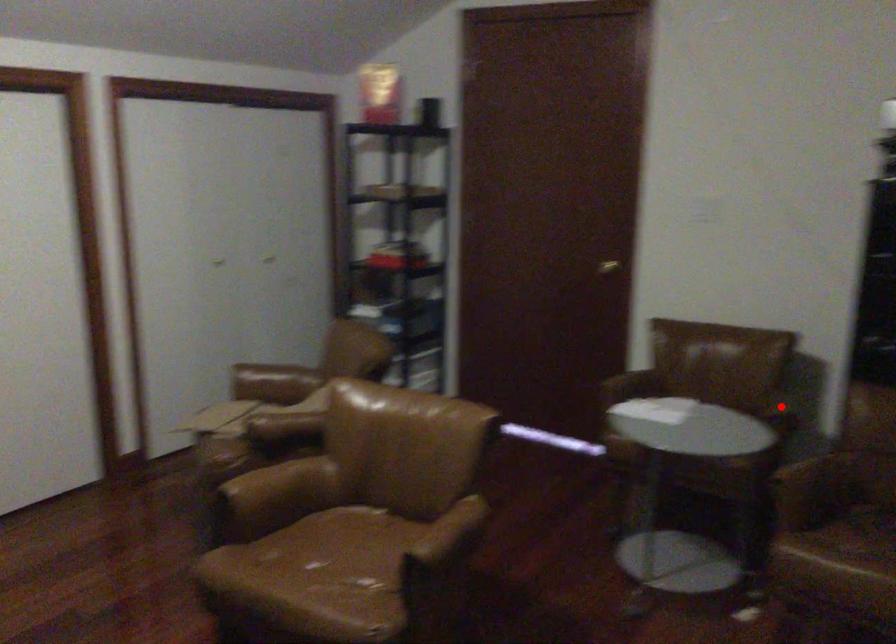
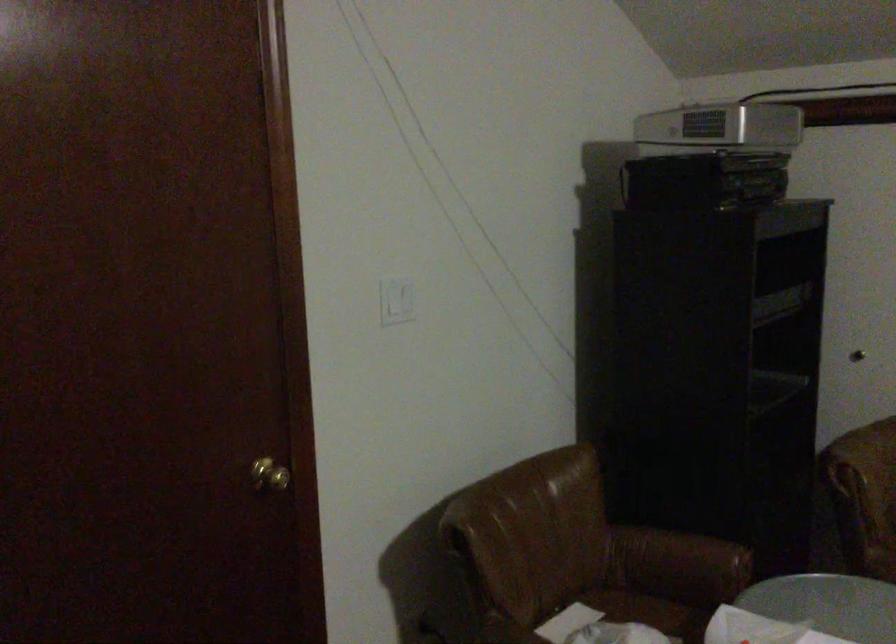
Locate, in the second image, the point that corresponds to the highlighted location in the first image.

(679, 559)